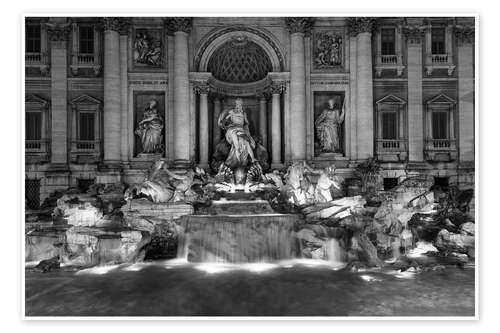
I want to click on light, so click(x=257, y=267).